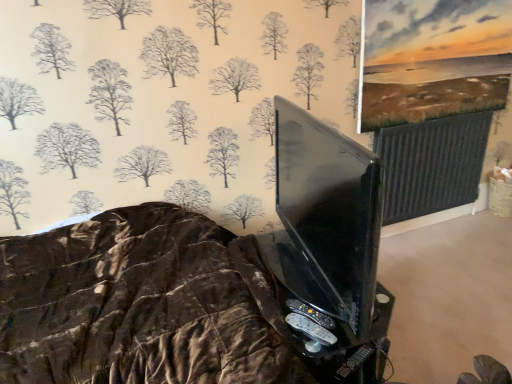
Find the location of a particular element. This screenshot has height=384, width=512. black glossy tv stand at lower center is located at coordinates (324, 318).

Describe the element at coordinates (324, 318) in the screenshot. The image size is (512, 384). I see `black glossy tv stand at lower center` at that location.

Where is `black plastic game controller at lower center`? This screenshot has height=384, width=512. black plastic game controller at lower center is located at coordinates (311, 325).

What do you see at coordinates (311, 325) in the screenshot? The height and width of the screenshot is (384, 512). I see `black plastic game controller at lower center` at bounding box center [311, 325].

Where is `black glossy tv stand at lower center`? The height and width of the screenshot is (384, 512). black glossy tv stand at lower center is located at coordinates pos(324,318).

Considering the relative positions of black glossy tv stand at lower center and black plastic game controller at lower center in the image provided, is black glossy tv stand at lower center to the left or to the right of black plastic game controller at lower center?

In the image, black glossy tv stand at lower center appears on the right side of black plastic game controller at lower center.

Is black glossy tv stand at lower center in front of or behind black plastic game controller at lower center in the image?

black glossy tv stand at lower center is positioned closer to the viewer than black plastic game controller at lower center.

Is point (321, 290) positioned after point (328, 342)?

Yes, point (321, 290) is behind point (328, 342).

From the image's perspective, relative to black plastic game controller at lower center, is black glossy tv stand at lower center above or below?

black glossy tv stand at lower center is below black plastic game controller at lower center.

Based on the photo, from a real-world perspective, which is physically above, black glossy tv stand at lower center or black plastic game controller at lower center?

From a 3D spatial view, black plastic game controller at lower center is above.

Considering the sizes of objects black glossy tv stand at lower center and black plastic game controller at lower center in the image provided, who is wider, black glossy tv stand at lower center or black plastic game controller at lower center?

black glossy tv stand at lower center is wider.

Who is shorter, black glossy tv stand at lower center or black plastic game controller at lower center?

black plastic game controller at lower center.

Does black glossy tv stand at lower center have a smaller size compared to black plastic game controller at lower center?

Incorrect, black glossy tv stand at lower center is not smaller in size than black plastic game controller at lower center.

Does black glossy tv stand at lower center contain black plastic game controller at lower center?

No.

Is there a large distance between black glossy tv stand at lower center and black plastic game controller at lower center?

No, there isn't a large distance between black glossy tv stand at lower center and black plastic game controller at lower center.

Is black glossy tv stand at lower center aimed at black plastic game controller at lower center?

No.

What's the angular difference between black glossy tv stand at lower center and black plastic game controller at lower center's facing directions?

The angular difference between black glossy tv stand at lower center and black plastic game controller at lower center is 67 degrees.

At what (x,y) coordinates should I click in order to perform the action: click on table on the right of black plastic game controller at lower center. Please return your answer as a coordinate pair (x, y). Image resolution: width=512 pixels, height=384 pixels. Looking at the image, I should click on (324, 318).

Would you say black plastic game controller at lower center is to the left or to the right of black glossy tv stand at lower center in the picture?

Based on their positions, black plastic game controller at lower center is located to the left of black glossy tv stand at lower center.

Based on the photo, considering their positions, is black plastic game controller at lower center located in front of or behind black glossy tv stand at lower center?

black plastic game controller at lower center is behind black glossy tv stand at lower center.

Which is in front, point (295, 326) or point (383, 358)?

The point (295, 326) is closer.

From the image's perspective, is black plastic game controller at lower center above or below black glossy tv stand at lower center?

black plastic game controller at lower center is above black glossy tv stand at lower center.

From a real-world perspective, is black plastic game controller at lower center positioned over black glossy tv stand at lower center based on gravity?

Yes, from a real-world perspective, black plastic game controller at lower center is on top of black glossy tv stand at lower center.

Between black plastic game controller at lower center and black glossy tv stand at lower center, which one has smaller width?

With smaller width is black plastic game controller at lower center.

In terms of height, does black plastic game controller at lower center look taller or shorter compared to black glossy tv stand at lower center?

In the image, black plastic game controller at lower center appears to be shorter than black glossy tv stand at lower center.

Considering the sizes of objects black plastic game controller at lower center and black glossy tv stand at lower center in the image provided, who is smaller, black plastic game controller at lower center or black glossy tv stand at lower center?

black plastic game controller at lower center is smaller.

Would you say black plastic game controller at lower center is outside black glossy tv stand at lower center?

Absolutely, black plastic game controller at lower center is external to black glossy tv stand at lower center.

Based on the photo, is black plastic game controller at lower center directly adjacent to black glossy tv stand at lower center?

There is a gap between black plastic game controller at lower center and black glossy tv stand at lower center.

Is black plastic game controller at lower center facing away from black glossy tv stand at lower center?

No, black plastic game controller at lower center's orientation is not away from black glossy tv stand at lower center.

The image size is (512, 384). Identify the location of table in front of the black plastic game controller at lower center. (324, 318).

Where is `table below the black plastic game controller at lower center (from a real-world perspective)`? table below the black plastic game controller at lower center (from a real-world perspective) is located at coordinates (324, 318).

Image resolution: width=512 pixels, height=384 pixels. Identify the location of game controller above the black glossy tv stand at lower center (from the image's perspective). (311, 325).